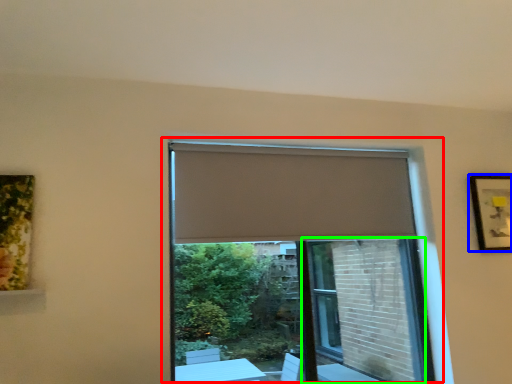
Question: Based on their relative distances, which object is farther from window (highlighted by a red box)? Choose from picture frame (highlighted by a blue box) and screen door (highlighted by a green box).

Choices:
 (A) picture frame
 (B) screen door

Answer: (A)